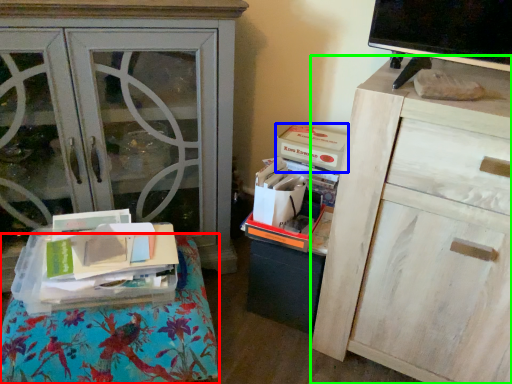
Question: Based on their relative distances, which object is farther from furniture (highlighted by a red box)? Choose from storage box (highlighted by a blue box) and chest of drawers (highlighted by a green box).

Choices:
 (A) storage box
 (B) chest of drawers

Answer: (A)